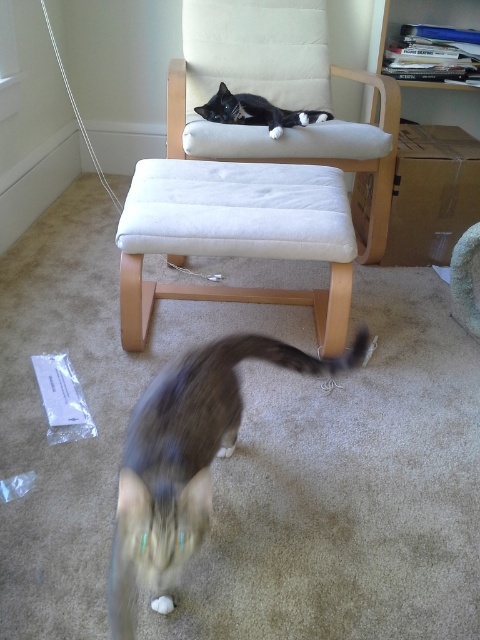
Is tabby fur cat at lower center above black and white fur cat at upper center?

Actually, tabby fur cat at lower center is below black and white fur cat at upper center.

Measure the distance between tabby fur cat at lower center and camera.

tabby fur cat at lower center and camera are 35.01 inches apart.

Find the location of a particular element. tabby fur cat at lower center is located at coordinates (186, 460).

Who is positioned more to the left, beige fabric armchair at upper center or black and white fur cat at upper center?

black and white fur cat at upper center is more to the left.

Is beige fabric armchair at upper center in front of black and white fur cat at upper center?

Yes, it is.

Who is more forward, [274,168] or [282,115]?

Positioned in front is point [274,168].

Where is `beige fabric armchair at upper center`? The height and width of the screenshot is (640, 480). beige fabric armchair at upper center is located at coordinates (277, 99).

Does white fabric stool at center appear on the left side of black and white fur cat at upper center?

Correct, you'll find white fabric stool at center to the left of black and white fur cat at upper center.

Looking at this image, is white fabric stool at center taller than black and white fur cat at upper center?

Correct, white fabric stool at center is much taller as black and white fur cat at upper center.

Measure the distance between point (215, 193) and camera.

Point (215, 193) is 5.73 feet away from camera.

This screenshot has height=640, width=480. In order to click on white fabric stool at center in this screenshot , I will do (236, 234).